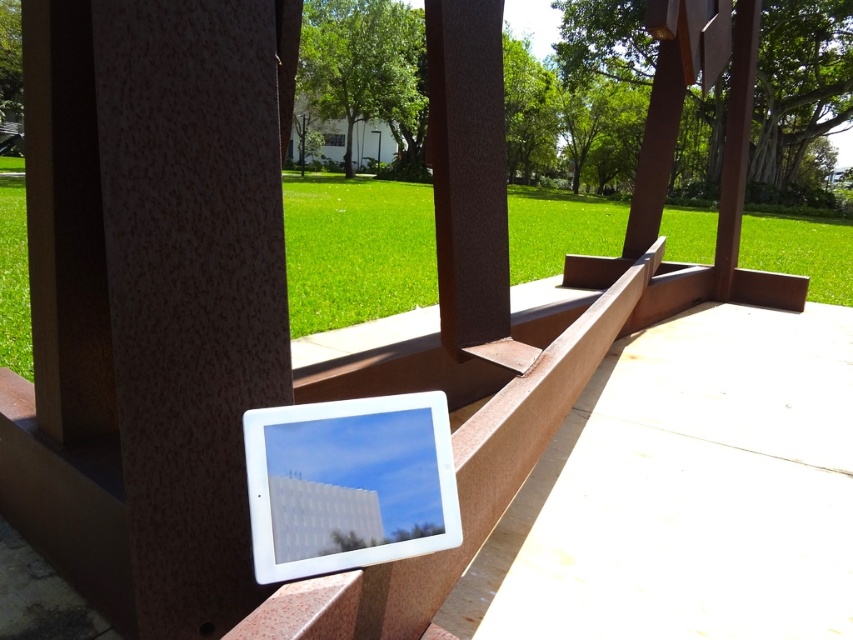
Question: Can you confirm if green grass at center is positioned to the right of white glossy tablet at center?

Choices:
 (A) no
 (B) yes

Answer: (A)

Question: Can you confirm if green grass at center is bigger than white glossy tablet at center?

Choices:
 (A) yes
 (B) no

Answer: (A)

Question: Based on their relative distances, which object is farther from the brown matte wood at center?

Choices:
 (A) white glossy tablet at center
 (B) green grass at center

Answer: (B)

Question: Is green grass at center to the left of white glossy tablet at center from the viewer's perspective?

Choices:
 (A) yes
 (B) no

Answer: (A)

Question: Which of the following is the closest to the observer?

Choices:
 (A) (467, 196)
 (B) (346, 545)

Answer: (B)

Question: Which of the following is the closest to the observer?

Choices:
 (A) (838, 266)
 (B) (407, 512)
 (C) (488, 180)

Answer: (B)